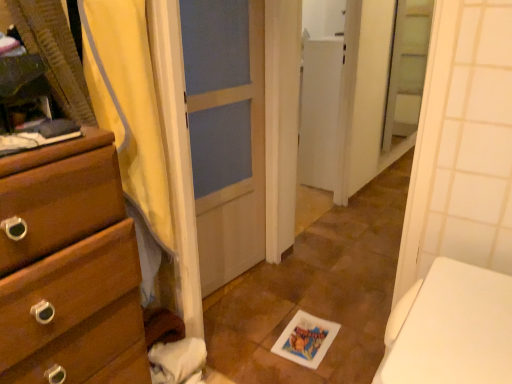
Question: Is yellow fabric shower curtain at left next to clear glass screen door at upper right?

Choices:
 (A) no
 (B) yes

Answer: (A)

Question: Is yellow fabric shower curtain at left to the right of clear glass screen door at upper right from the viewer's perspective?

Choices:
 (A) no
 (B) yes

Answer: (A)

Question: From the image's perspective, is yellow fabric shower curtain at left under clear glass screen door at upper right?

Choices:
 (A) yes
 (B) no

Answer: (A)

Question: From a real-world perspective, is yellow fabric shower curtain at left beneath clear glass screen door at upper right?

Choices:
 (A) no
 (B) yes

Answer: (A)

Question: Does yellow fabric shower curtain at left have a greater width compared to clear glass screen door at upper right?

Choices:
 (A) no
 (B) yes

Answer: (B)

Question: Does yellow fabric shower curtain at left turn towards clear glass screen door at upper right?

Choices:
 (A) no
 (B) yes

Answer: (A)

Question: Is yellow fabric shower curtain at left positioned far away from wooden chest of drawers at left?

Choices:
 (A) yes
 (B) no

Answer: (B)

Question: Is yellow fabric shower curtain at left positioned before wooden chest of drawers at left?

Choices:
 (A) yes
 (B) no

Answer: (B)

Question: From the image's perspective, is yellow fabric shower curtain at left above wooden chest of drawers at left?

Choices:
 (A) yes
 (B) no

Answer: (A)

Question: Is yellow fabric shower curtain at left positioned beyond the bounds of wooden chest of drawers at left?

Choices:
 (A) no
 (B) yes

Answer: (B)

Question: Could you tell me if yellow fabric shower curtain at left is facing wooden chest of drawers at left?

Choices:
 (A) yes
 (B) no

Answer: (B)

Question: Is yellow fabric shower curtain at left with wooden chest of drawers at left?

Choices:
 (A) no
 (B) yes

Answer: (A)

Question: Does clear glass screen door at upper right have a lesser width compared to yellow fabric shower curtain at left?

Choices:
 (A) no
 (B) yes

Answer: (B)